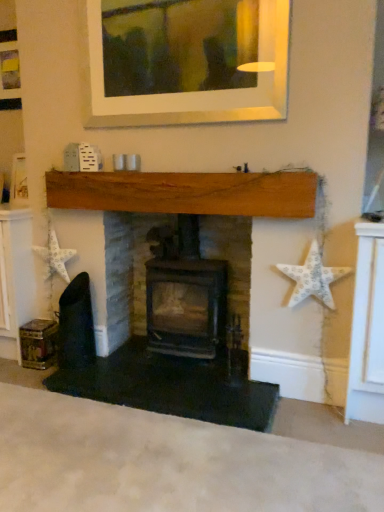
Question: From the image's perspective, would you say white paper star at left, the second starfish when ordered from right to left, is shown under white textured star at right, the first starfish viewed from the front?

Choices:
 (A) yes
 (B) no

Answer: (B)

Question: Is white paper star at left, which appears as the first starfish when viewed from the left, looking in the opposite direction of white textured star at right, which is the second starfish in left-to-right order?

Choices:
 (A) yes
 (B) no

Answer: (B)

Question: Considering the relative sizes of white paper star at left, the second starfish when ordered from right to left, and white textured star at right, the second starfish when ordered from back to front, in the image provided, is white paper star at left, the second starfish when ordered from right to left, taller than white textured star at right, the second starfish when ordered from back to front,?

Choices:
 (A) no
 (B) yes

Answer: (A)

Question: Is white paper star at left, which appears as the first starfish when viewed from the left, with white textured star at right, the second starfish when ordered from back to front?

Choices:
 (A) no
 (B) yes

Answer: (A)

Question: Can you confirm if white paper star at left, which appears as the first starfish when viewed from the left, is shorter than white textured star at right, which is the second starfish in left-to-right order?

Choices:
 (A) yes
 (B) no

Answer: (A)

Question: Does point (104, 361) appear closer or farther from the camera than point (145, 230)?

Choices:
 (A) closer
 (B) farther

Answer: (A)

Question: Considering the positions of wooden fireplace at center, which is counted as the first fireplace, starting from the left, and black cast iron stove at center, placed as the 2th fireplace when sorted from left to right, in the image, is wooden fireplace at center, which is counted as the first fireplace, starting from the left, bigger or smaller than black cast iron stove at center, placed as the 2th fireplace when sorted from left to right,?

Choices:
 (A) small
 (B) big

Answer: (A)

Question: Relative to black cast iron stove at center, which appears as the first fireplace when viewed from the right, is wooden fireplace at center, which is counted as the second fireplace, starting from the right, in front or behind?

Choices:
 (A) front
 (B) behind

Answer: (A)

Question: Is wooden fireplace at center, which is counted as the second fireplace, starting from the right, taller or shorter than black cast iron stove at center, placed as the 2th fireplace when sorted from left to right?

Choices:
 (A) tall
 (B) short

Answer: (A)

Question: Would you say wooden fireplace at center, which is counted as the second fireplace, starting from the right, is to the left or to the right of white paper star at left, the second starfish when ordered from right to left, in the picture?

Choices:
 (A) right
 (B) left

Answer: (A)

Question: Is wooden fireplace at center, which is counted as the second fireplace, starting from the right, inside or outside of white paper star at left, which is counted as the second starfish, starting from the front?

Choices:
 (A) outside
 (B) inside

Answer: (A)

Question: Is point pos(97,362) closer or farther from the camera than point pos(52,238)?

Choices:
 (A) farther
 (B) closer

Answer: (B)

Question: Considering the positions of wooden fireplace at center, which is counted as the first fireplace, starting from the left, and white paper star at left, the first starfish viewed from the back, in the image, is wooden fireplace at center, which is counted as the first fireplace, starting from the left, wider or thinner than white paper star at left, the first starfish viewed from the back,?

Choices:
 (A) wide
 (B) thin

Answer: (B)

Question: Is point coord(51,269) positioned closer to the camera than point coord(203,251)?

Choices:
 (A) farther
 (B) closer

Answer: (B)

Question: Considering their positions, is white paper star at left, the first starfish viewed from the back, located in front of or behind black cast iron stove at center, which appears as the first fireplace when viewed from the right?

Choices:
 (A) behind
 (B) front

Answer: (A)